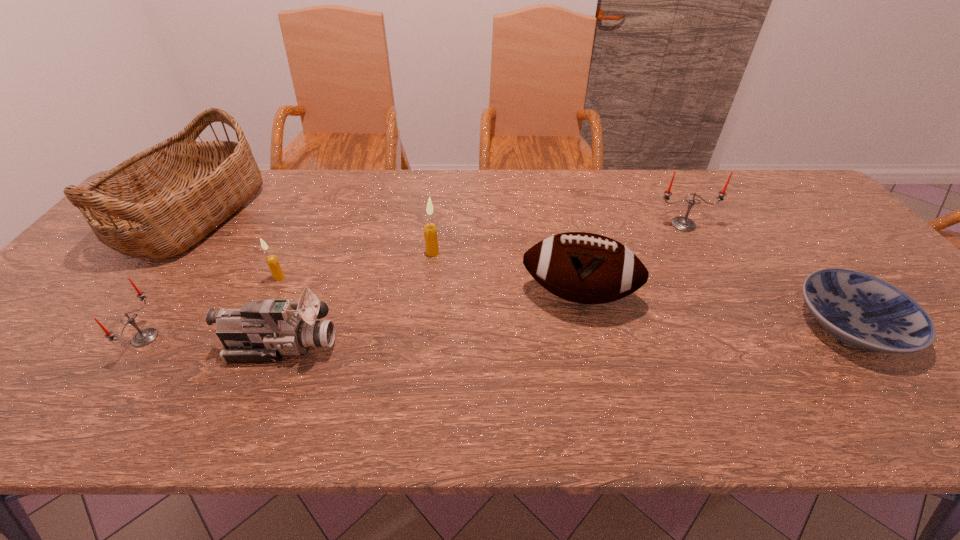
In the image, there is a desktop. Identify the location of vacant space at the far right corner. The image size is (960, 540). (788, 179).

I want to click on free space between the rightmost object and the camcorder, so click(566, 335).

Find the location of a particular element. The height and width of the screenshot is (540, 960). vacant space in between the tallest object and the second candle from left to right is located at coordinates (236, 246).

Image resolution: width=960 pixels, height=540 pixels. Find the location of `vacant area between the camcorder and the fourth object from right to left`. vacant area between the camcorder and the fourth object from right to left is located at coordinates (357, 299).

You are a GUI agent. You are given a task and a screenshot of the screen. Output one action in this format:
    pyautogui.click(x=<x>, y=<y>)
    Task: Click on the vacant area that lies between the farther cream candle and the brown basket
    The height and width of the screenshot is (540, 960).
    Given the screenshot: What is the action you would take?
    pyautogui.click(x=313, y=234)

At what (x,y) coordinates should I click in order to perform the action: click on free space between the nearer cream candle and the rightmost object. Please return your answer as a coordinate pair (x, y). Looking at the image, I should click on (565, 301).

Image resolution: width=960 pixels, height=540 pixels. Identify the location of empty space that is in between the left cream candle and the rightmost object. (565, 301).

You are a GUI agent. You are given a task and a screenshot of the screen. Output one action in this format:
    pyautogui.click(x=<x>, y=<y>)
    Task: Click on the free space between the smaller red candle and the camcorder
    Image resolution: width=960 pixels, height=540 pixels.
    Given the screenshot: What is the action you would take?
    pyautogui.click(x=213, y=341)

I want to click on free space between the left cream candle and the seventh object from left to right, so click(x=481, y=251).

Identify the location of vacant space that's between the right red candle and the plate. (767, 275).